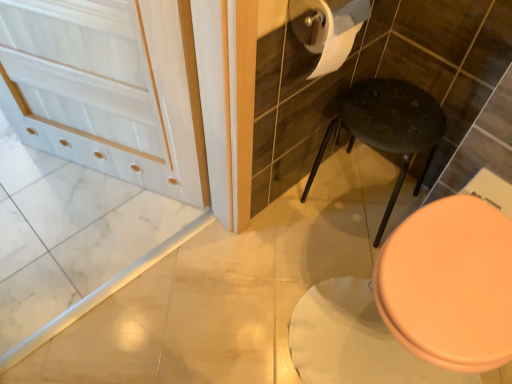
Question: From the image's perspective, is pink glossy toilet seat at lower right above or below white matte screen door at upper left?

Choices:
 (A) below
 (B) above

Answer: (A)

Question: Considering the relative positions of pink glossy toilet seat at lower right and white matte screen door at upper left in the image provided, is pink glossy toilet seat at lower right to the left or to the right of white matte screen door at upper left?

Choices:
 (A) right
 (B) left

Answer: (A)

Question: Estimate the real-world distances between objects in this image. Which object is farther from the dark speckled plastic stool at center?

Choices:
 (A) pink glossy toilet seat at lower right
 (B) white matte screen door at upper left
 (C) white matte toilet paper at upper right

Answer: (B)

Question: Estimate the real-world distances between objects in this image. Which object is closer to the pink glossy toilet seat at lower right?

Choices:
 (A) white matte screen door at upper left
 (B) white matte toilet paper at upper right
 (C) dark speckled plastic stool at center

Answer: (C)